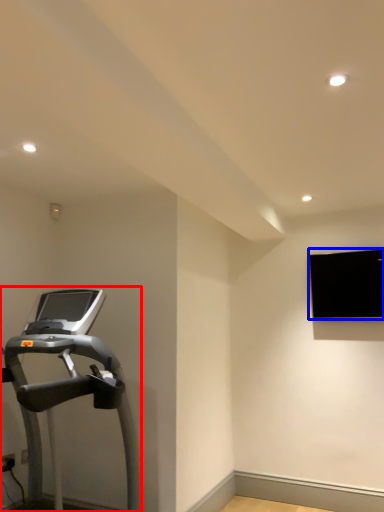
Question: Which of the following is the closest to the observer, treadmill (highlighted by a red box) or projection screen (highlighted by a blue box)?

Choices:
 (A) treadmill
 (B) projection screen

Answer: (A)